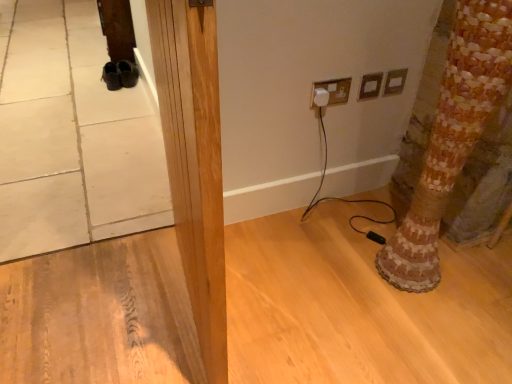
Question: Is wooden mosaic tree trunk at lower right facing away from natural wood pillar at center?

Choices:
 (A) yes
 (B) no

Answer: (B)

Question: From the image's perspective, is wooden mosaic tree trunk at lower right below natural wood pillar at center?

Choices:
 (A) yes
 (B) no

Answer: (B)

Question: Are wooden mosaic tree trunk at lower right and natural wood pillar at center located far from each other?

Choices:
 (A) no
 (B) yes

Answer: (A)

Question: Considering the relative sizes of wooden mosaic tree trunk at lower right and natural wood pillar at center in the image provided, is wooden mosaic tree trunk at lower right taller than natural wood pillar at center?

Choices:
 (A) no
 (B) yes

Answer: (A)

Question: From a real-world perspective, is wooden mosaic tree trunk at lower right physically above natural wood pillar at center?

Choices:
 (A) yes
 (B) no

Answer: (B)

Question: Is wooden mosaic tree trunk at lower right to the left of natural wood pillar at center from the viewer's perspective?

Choices:
 (A) no
 (B) yes

Answer: (A)

Question: From the image's perspective, is matte plastic outlet at upper right, acting as the 2th electric outlet starting from the left, on top of white plastic plug at upper center, the 3th electric outlet from the right?

Choices:
 (A) no
 (B) yes

Answer: (B)

Question: Would you say matte plastic outlet at upper right, which is the second electric outlet from right to left, contains white plastic plug at upper center, the 3th electric outlet from the right?

Choices:
 (A) yes
 (B) no

Answer: (B)

Question: From a real-world perspective, is matte plastic outlet at upper right, which is the second electric outlet from right to left, positioned under white plastic plug at upper center, the 3th electric outlet from the right, based on gravity?

Choices:
 (A) yes
 (B) no

Answer: (A)

Question: Is the depth of matte plastic outlet at upper right, which is the second electric outlet from right to left, less than that of white plastic plug at upper center, the 1th electric outlet from the left?

Choices:
 (A) yes
 (B) no

Answer: (B)

Question: From a real-world perspective, is matte plastic outlet at upper right, acting as the 2th electric outlet starting from the left, located higher than white plastic plug at upper center, the 1th electric outlet from the left?

Choices:
 (A) no
 (B) yes

Answer: (A)

Question: Is matte plastic outlet at upper right, which is the second electric outlet from right to left, thinner than white plastic plug at upper center, the 1th electric outlet from the left?

Choices:
 (A) no
 (B) yes

Answer: (B)

Question: Is natural wood pillar at center beside wooden mosaic tree trunk at lower right?

Choices:
 (A) yes
 (B) no

Answer: (B)